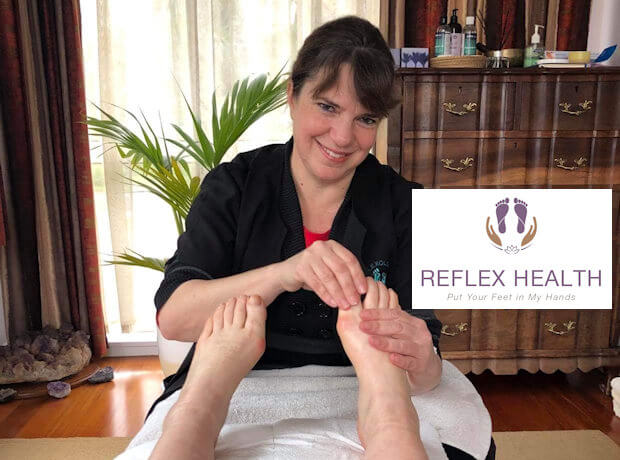
The width and height of the screenshot is (620, 460). What are the coordinates of `rug carpet` in the screenshot? It's located at (547, 442).